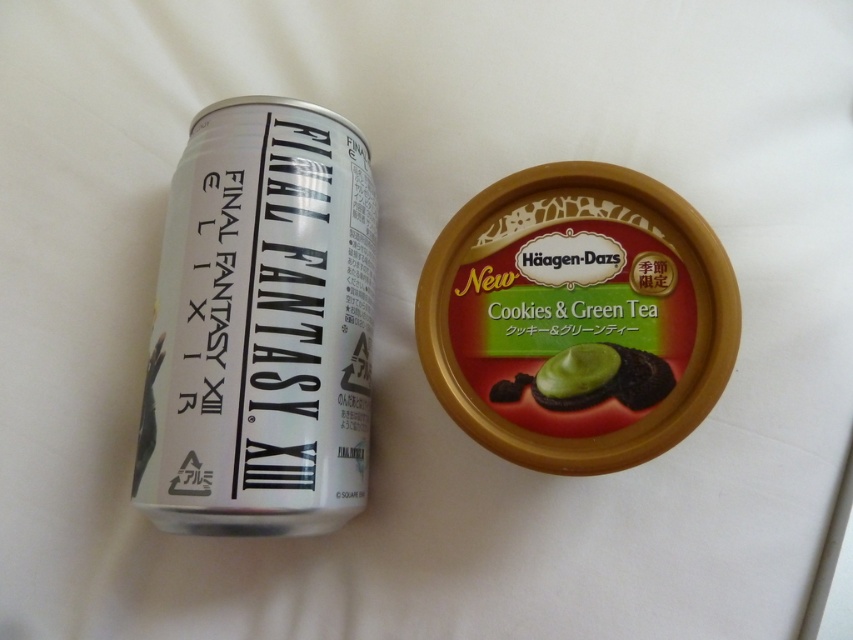
You are planning to place both the green matte ice cream container at center and the green matte chocolate cookie at center into a rectangular box that can only accommodate items up to the width of the wider object. Which object should you use to determine the minimum required width of the box?

The green matte ice cream container at center has a greater width than the green matte chocolate cookie at center, so the box must be at least as wide as the green matte ice cream container at center to fit both items.

Based on the photo, you are at a picnic and have both the green matte ice cream container at center and the green matte chocolate cookie at center in front of you. Which item is located to the left?

The green matte ice cream container at center is positioned to the left of the green matte chocolate cookie at center, so the green matte ice cream container at center is located to the left.